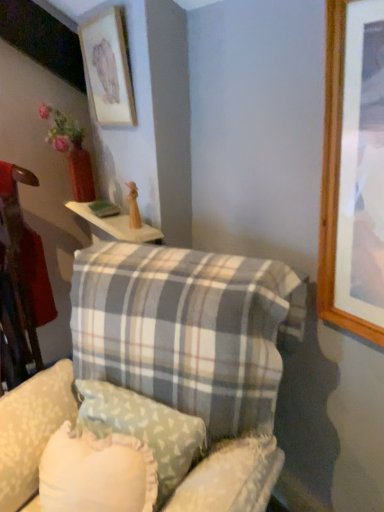
Locate an element on the screen. This screenshot has height=512, width=384. vacant point above white wood table at upper center (from a real-world perspective) is located at coordinates (94, 207).